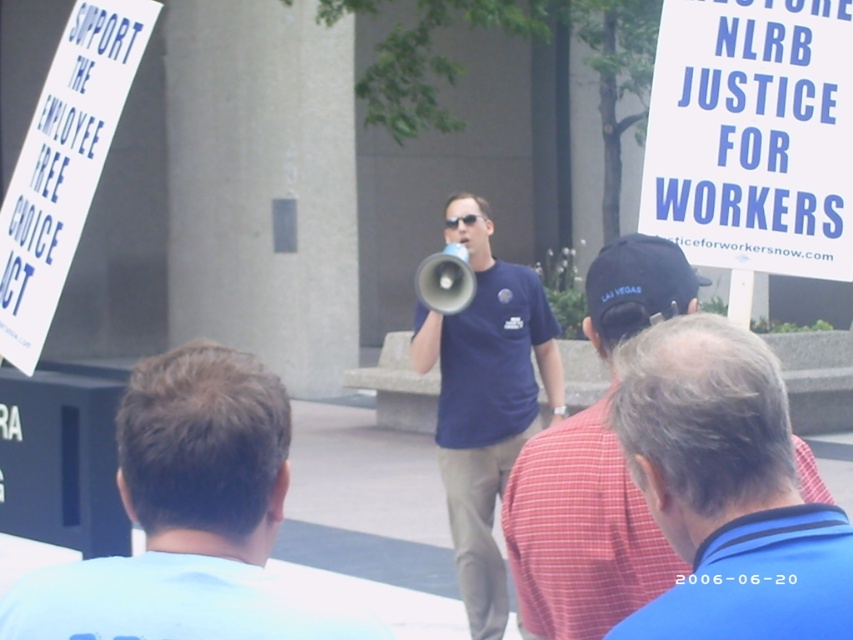
In the scene shown: Does red plaid shirt at center have a greater height compared to blue cotton shirt at center?

No.

Can you confirm if red plaid shirt at center is smaller than blue cotton shirt at center?

Yes.

Does point (610, 305) lie in front of point (473, 561)?

Yes, it is in front of point (473, 561).

Image resolution: width=853 pixels, height=640 pixels. I want to click on red plaid shirt at center, so click(x=579, y=531).

Is point (151, 384) positioned after point (485, 628)?

No, it is not.

Which is behind, point (196, 588) or point (490, 360)?

Positioned behind is point (490, 360).

At what (x,y) coordinates should I click in order to perform the action: click on light blue t-shirt at lower left. Please return your answer as a coordinate pair (x, y). Looking at the image, I should click on (190, 518).

Consider the image. Who is positioned more to the left, light blue t-shirt at lower left or red plaid shirt at center?

From the viewer's perspective, light blue t-shirt at lower left appears more on the left side.

Which is behind, point (250, 497) or point (608, 573)?

Point (608, 573)

Where is `light blue t-shirt at lower left`? The width and height of the screenshot is (853, 640). light blue t-shirt at lower left is located at coordinates (190, 518).